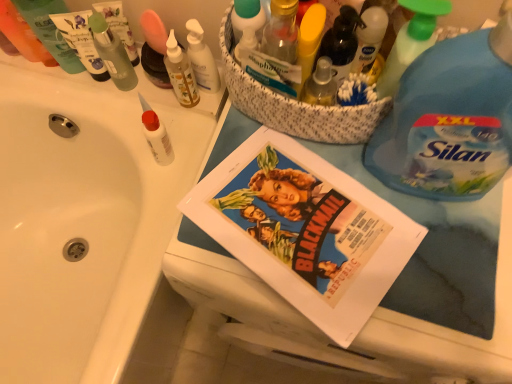
In order to click on vacant point to the right of matte paper comic book at center in this screenshot , I will do `click(447, 281)`.